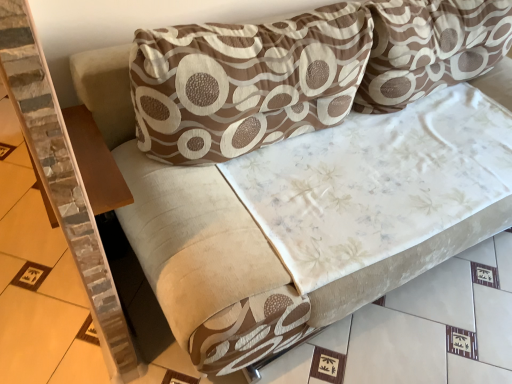
Locate an element on the screen. blank space situated above brown wood table at left (from a real-world perspective) is located at coordinates (92, 157).